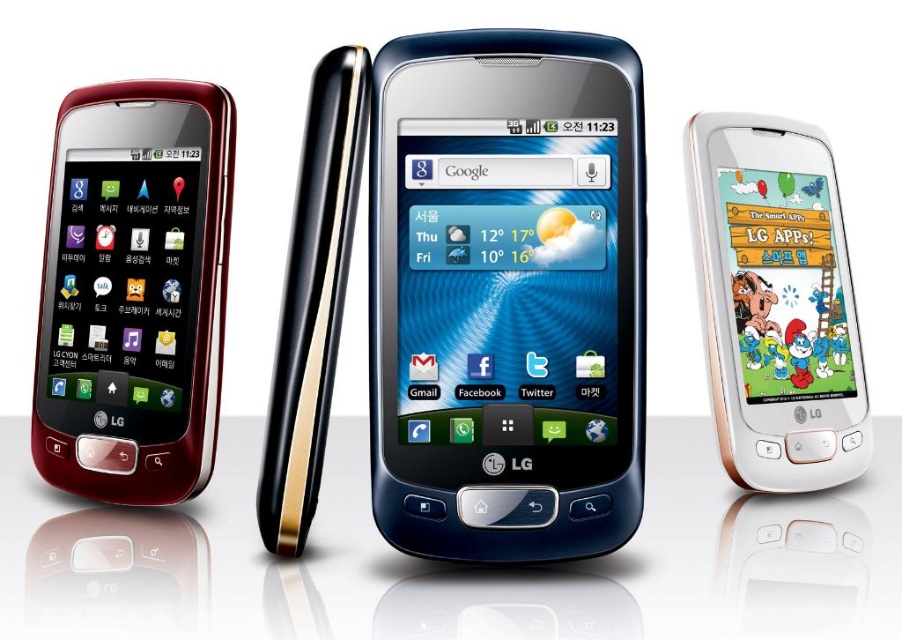
Does satin black phone at center appear over matte black phone at left?

Actually, satin black phone at center is below matte black phone at left.

Which is more to the right, satin black phone at center or matte black phone at left?

satin black phone at center is more to the right.

The width and height of the screenshot is (902, 640). I want to click on satin black phone at center, so (505, 294).

Can you confirm if matte black phone at left is positioned below white glossy phone at right?

No.

Based on the photo, can you confirm if matte black phone at left is thinner than white glossy phone at right?

No, matte black phone at left is not thinner than white glossy phone at right.

Measure the distance between point [58,161] and camera.

A distance of 28.55 inches exists between point [58,161] and camera.

Image resolution: width=902 pixels, height=640 pixels. I want to click on matte black phone at left, so click(x=134, y=291).

Between satin black phone at center and white glossy phone at right, which one appears on the right side from the viewer's perspective?

Positioned to the right is white glossy phone at right.

Between satin black phone at center and white glossy phone at right, which one is positioned higher?

satin black phone at center is above.

Find the location of a particular element. satin black phone at center is located at coordinates (505, 294).